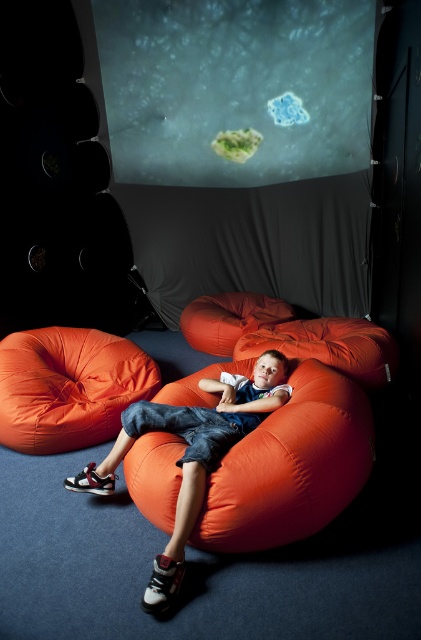
Who is higher up, orange fabric bean bag at center or orange fabric bean bag at lower left?

orange fabric bean bag at lower left

Does orange fabric bean bag at center have a lesser width compared to orange fabric bean bag at lower left?

In fact, orange fabric bean bag at center might be wider than orange fabric bean bag at lower left.

Who is more distant from viewer, (304, 426) or (50, 406)?

The point (50, 406) is behind.

In order to click on orange fabric bean bag at center in this screenshot , I will do `click(290, 467)`.

Is orange fabric bean bag at center taller than matte orange beanbag at center?

In fact, orange fabric bean bag at center may be shorter than matte orange beanbag at center.

Which of these two, orange fabric bean bag at center or matte orange beanbag at center, stands taller?

matte orange beanbag at center

Where is `orange fabric bean bag at center`? Image resolution: width=421 pixels, height=640 pixels. orange fabric bean bag at center is located at coordinates (290, 467).

Can you confirm if orange fabric bean bag at lower left is positioned to the left of matte orange beanbag at center?

Yes, orange fabric bean bag at lower left is to the left of matte orange beanbag at center.

Is orange fabric bean bag at lower left wider than matte orange beanbag at center?

Incorrect, orange fabric bean bag at lower left's width does not surpass matte orange beanbag at center's.

This screenshot has height=640, width=421. What do you see at coordinates (69, 387) in the screenshot?
I see `orange fabric bean bag at lower left` at bounding box center [69, 387].

The width and height of the screenshot is (421, 640). I want to click on orange fabric bean bag at lower left, so click(69, 387).